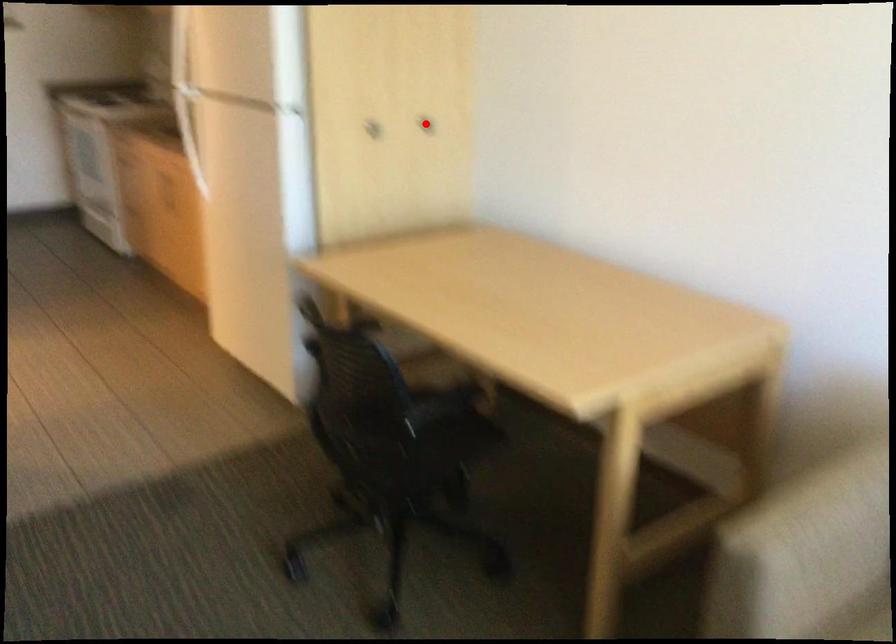
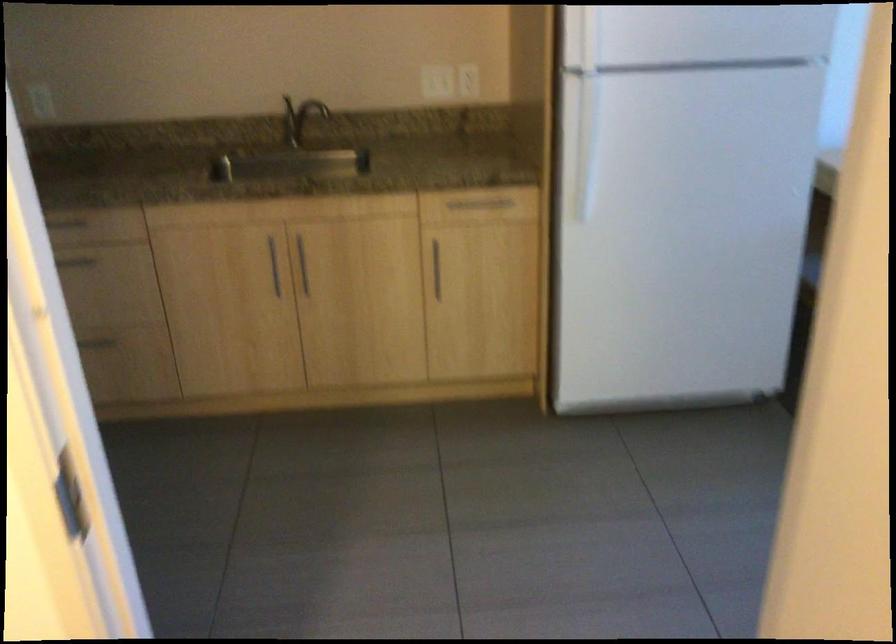
Question: I am providing you with two images of the same scene from different viewpoints. A red point is marked on the first image. At the location where the point appears in image 1, is it still visible in image 2?

Choices:
 (A) Yes
 (B) No

Answer: (B)